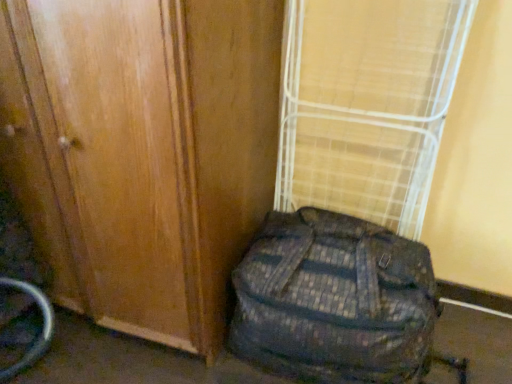
Question: Is camouflage fabric backpack at lower right situated inside wooden door at center or outside?

Choices:
 (A) inside
 (B) outside

Answer: (B)

Question: Is point (371, 266) closer or farther from the camera than point (156, 163)?

Choices:
 (A) closer
 (B) farther

Answer: (B)

Question: Considering the real-world distances, which object is closest to the bamboo mat at center?

Choices:
 (A) wooden door at center
 (B) camouflage fabric backpack at lower right

Answer: (B)

Question: Which is nearer to the wooden door at center?

Choices:
 (A) bamboo mat at center
 (B) camouflage fabric backpack at lower right

Answer: (B)